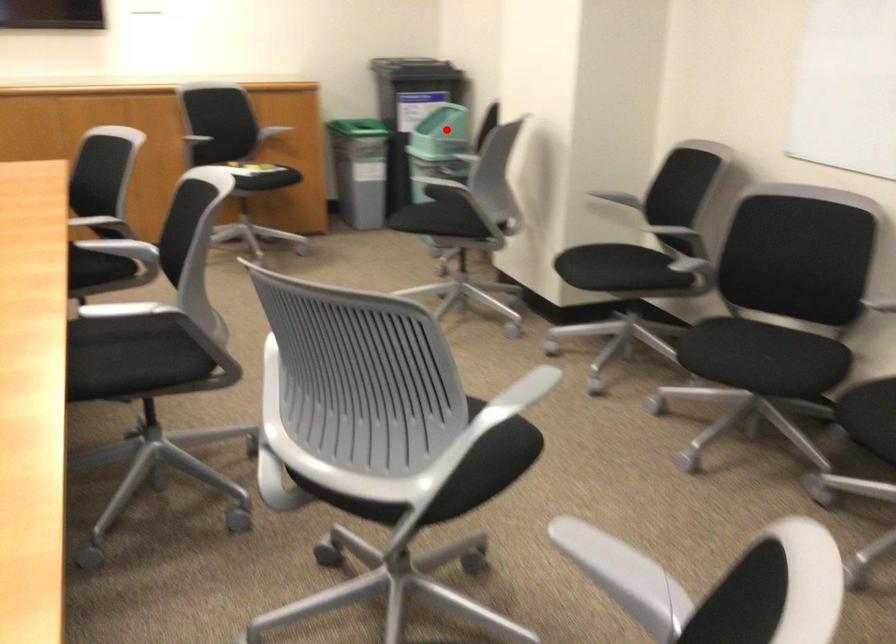
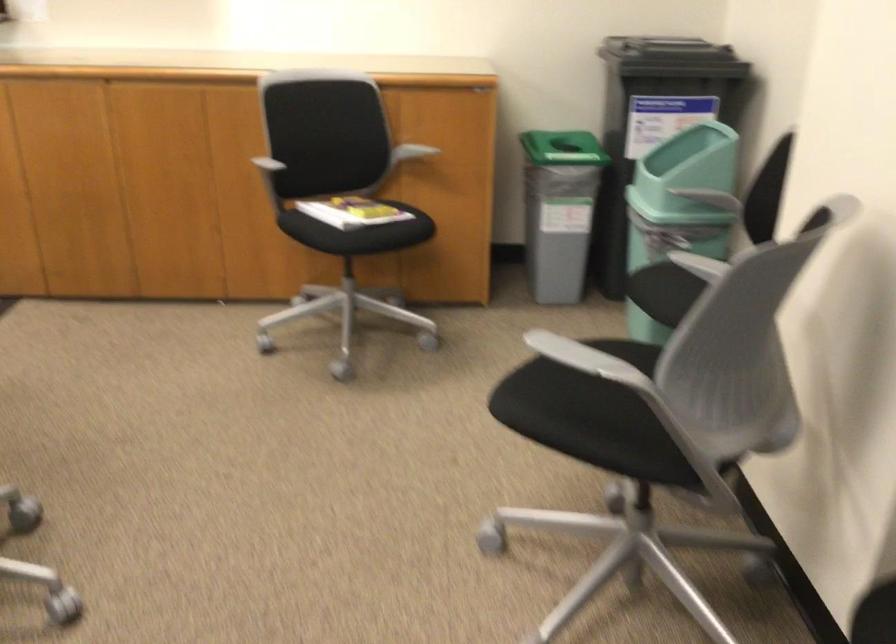
Locate, in the second image, the point that corresponds to the highlighted location in the first image.

(678, 207)